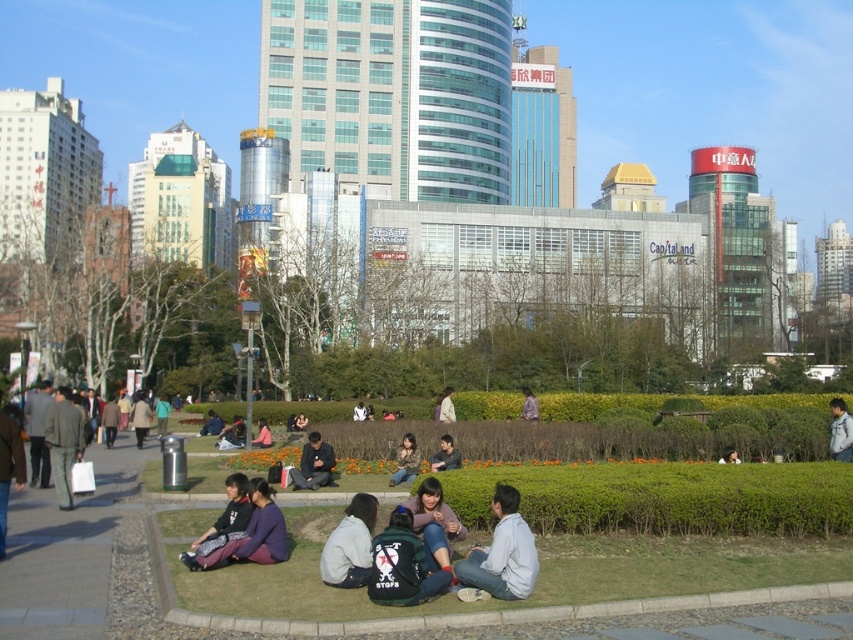
Between light gray cotton shirt at lower center and dark gray sweater at center, which one has less height?

Standing shorter between the two is dark gray sweater at center.

Is light gray cotton shirt at lower center to the right of dark gray sweater at center from the viewer's perspective?

Indeed, light gray cotton shirt at lower center is positioned on the right side of dark gray sweater at center.

Is point (518, 540) positioned behind point (254, 444)?

No, it is not.

Image resolution: width=853 pixels, height=640 pixels. What are the coordinates of `light gray cotton shirt at lower center` in the screenshot? It's located at click(502, 552).

Who is more forward, (413, 435) or (728, 460)?

Point (728, 460)

Is point (410, 451) less distant than point (730, 451)?

No, (410, 451) is further to viewer.

What do you see at coordinates (405, 461) in the screenshot? I see `camouflage jacket at center` at bounding box center [405, 461].

Where is `camouflage jacket at center`? Image resolution: width=853 pixels, height=640 pixels. camouflage jacket at center is located at coordinates (405, 461).

How much distance is there between dark purple sweater at lower center and dark gray jacket at lower right?

A distance of 12.99 meters exists between dark purple sweater at lower center and dark gray jacket at lower right.

Based on the photo, is dark purple sweater at lower center to the left of dark gray jacket at lower right from the viewer's perspective?

Indeed, dark purple sweater at lower center is positioned on the left side of dark gray jacket at lower right.

Image resolution: width=853 pixels, height=640 pixels. Identify the location of dark purple sweater at lower center. [222, 528].

The width and height of the screenshot is (853, 640). In order to click on dark purple sweater at lower center in this screenshot , I will do pos(222,528).